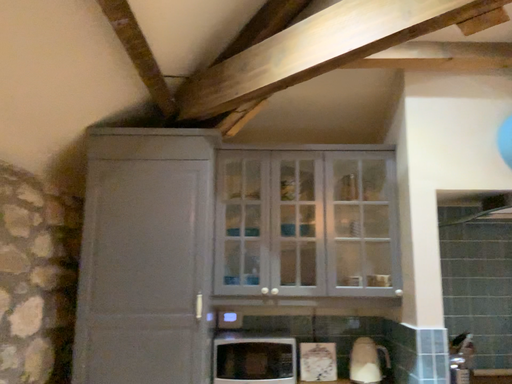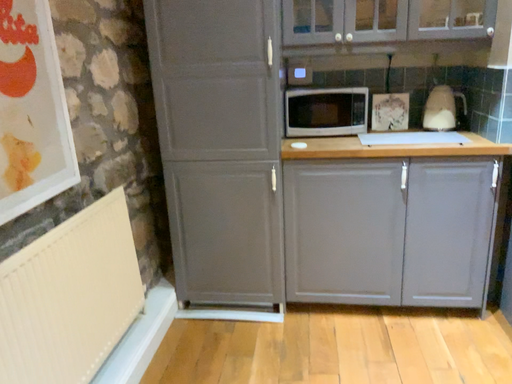
Question: How did the camera likely rotate when shooting the video?

Choices:
 (A) rotated right
 (B) rotated left

Answer: (B)